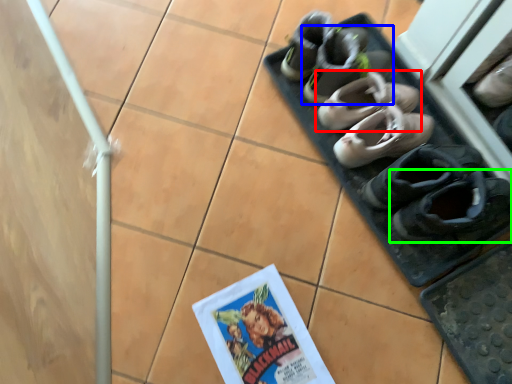
Question: Considering the real-world distances, which object is closest to footwear (highlighted by a red box)? footwear (highlighted by a blue box) or footwear (highlighted by a green box).

Choices:
 (A) footwear
 (B) footwear

Answer: (A)